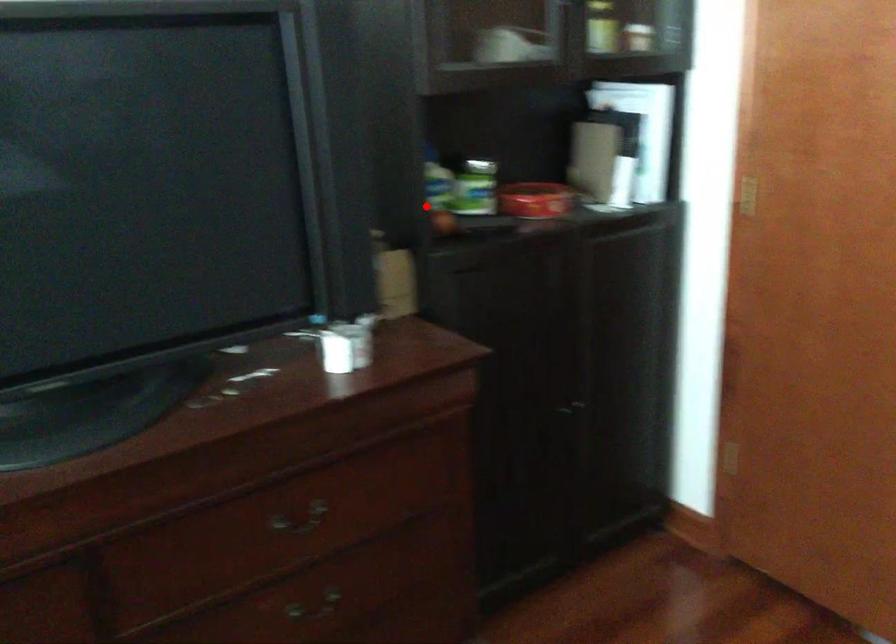
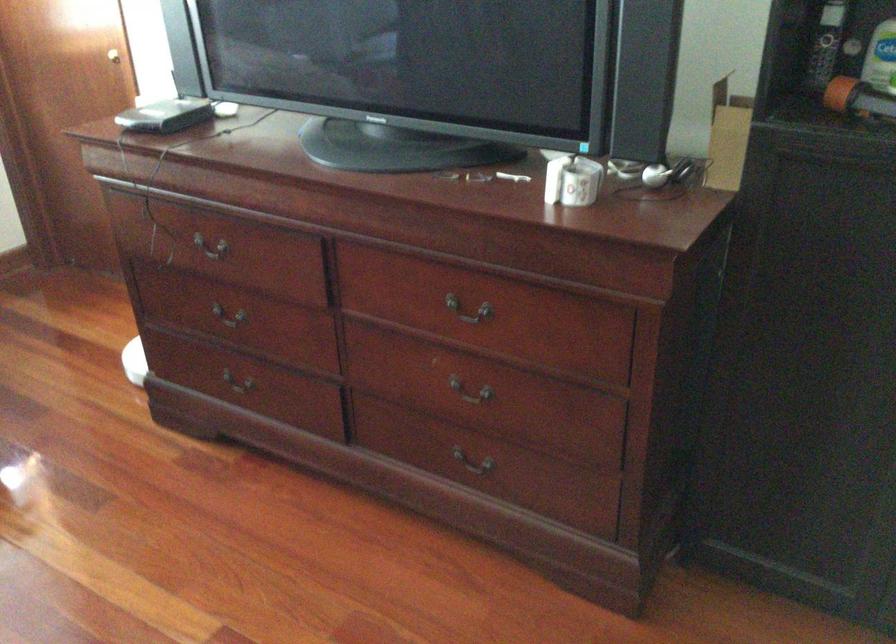
Question: I am providing you with two images of the same scene from different viewpoints. In image1, a red point is highlighted. Considering the same 3D point in image2, which of the following is correct?

Choices:
 (A) It is closer
 (B) It is farther

Answer: (A)